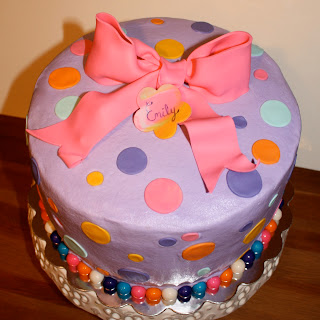
This screenshot has width=320, height=320. Find the location of `brown table`. brown table is located at coordinates (283, 294).